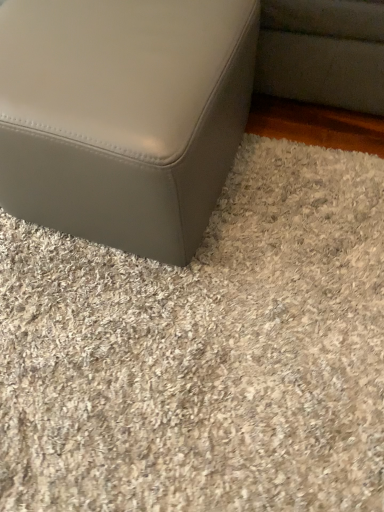
Question: From their relative heights in the image, would you say matte gray ottoman at lower left is taller or shorter than matte gray ottoman at lower left?

Choices:
 (A) short
 (B) tall

Answer: (A)

Question: Relative to matte gray ottoman at lower left, is matte gray ottoman at lower left in front or behind?

Choices:
 (A) front
 (B) behind

Answer: (B)

Question: Is matte gray ottoman at lower left bigger or smaller than matte gray ottoman at lower left?

Choices:
 (A) small
 (B) big

Answer: (A)

Question: From the image's perspective, relative to matte gray ottoman at lower left, is matte gray ottoman at lower left above or below?

Choices:
 (A) below
 (B) above

Answer: (B)

Question: Would you say matte gray ottoman at lower left is inside or outside matte gray ottoman at lower left?

Choices:
 (A) inside
 (B) outside

Answer: (B)

Question: Looking at their shapes, would you say matte gray ottoman at lower left is wider or thinner than matte gray ottoman at lower left?

Choices:
 (A) thin
 (B) wide

Answer: (A)

Question: Considering their positions, is matte gray ottoman at lower left located in front of or behind matte gray ottoman at lower left?

Choices:
 (A) behind
 (B) front

Answer: (B)